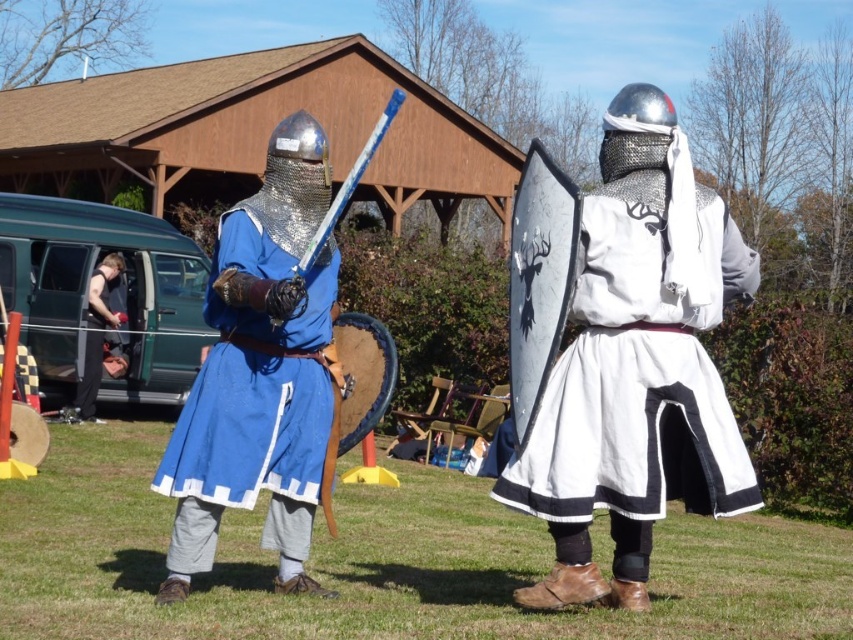
Which is below, white cotton tunic at center or matte blue tunic at center?

matte blue tunic at center is lower down.

Between white cotton tunic at center and matte blue tunic at center, which one has more height?

matte blue tunic at center

Between point (670, 156) and point (305, 532), which one is positioned behind?

Point (305, 532)

Identify the location of white cotton tunic at center. (636, 365).

Does matte blue tunic at center appear over black leather gloves at left?

No, matte blue tunic at center is not above black leather gloves at left.

Image resolution: width=853 pixels, height=640 pixels. What are the coordinates of `matte blue tunic at center` in the screenshot? It's located at (260, 372).

This screenshot has width=853, height=640. I want to click on matte blue tunic at center, so pos(260,372).

Locate an element on the screen. matte blue tunic at center is located at coordinates (260, 372).

How much distance is there between white cotton tunic at center and black leather gloves at left?

The distance of white cotton tunic at center from black leather gloves at left is 9.85 meters.

Does white cotton tunic at center have a greater height compared to black leather gloves at left?

Correct, white cotton tunic at center is much taller as black leather gloves at left.

Find the location of a particular element. This screenshot has height=640, width=853. white cotton tunic at center is located at coordinates (636, 365).